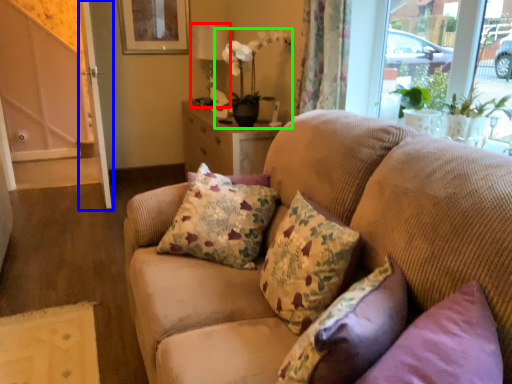
Question: Estimate the real-world distances between objects in this image. Which object is closer to lamp (highlighted by a red box), screen door (highlighted by a blue box) or houseplant (highlighted by a green box)?

Choices:
 (A) screen door
 (B) houseplant

Answer: (B)